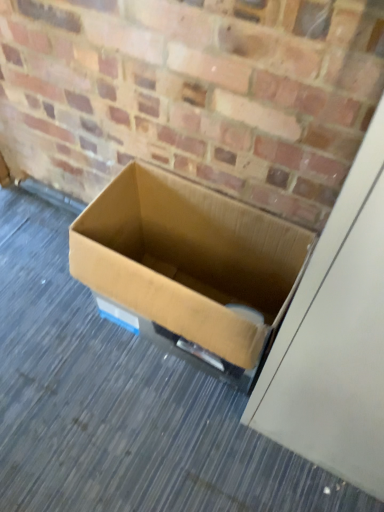
This screenshot has width=384, height=512. I want to click on brown cardboard box at center, so click(x=188, y=260).

The width and height of the screenshot is (384, 512). What do you see at coordinates (188, 260) in the screenshot? I see `brown cardboard box at center` at bounding box center [188, 260].

Where is `brown cardboard box at center`? The height and width of the screenshot is (512, 384). brown cardboard box at center is located at coordinates (121, 403).

Describe the element at coordinates (121, 403) in the screenshot. I see `brown cardboard box at center` at that location.

This screenshot has height=512, width=384. In order to click on brown cardboard box at center in this screenshot , I will do `click(188, 260)`.

Can you confirm if brown cardboard box at center is positioned to the left of brown cardboard box at center?

No.

Which is behind, brown cardboard box at center or brown cardboard box at center?

brown cardboard box at center is further away from the camera.

Does point (161, 243) appear closer or farther from the camera than point (80, 417)?

Point (161, 243) is positioned farther from the camera compared to point (80, 417).

From the image's perspective, which one is positioned lower, brown cardboard box at center or brown cardboard box at center?

brown cardboard box at center, from the image's perspective.

From a real-world perspective, is brown cardboard box at center under brown cardboard box at center?

No, from a real-world perspective, brown cardboard box at center is not under brown cardboard box at center.

Between brown cardboard box at center and brown cardboard box at center, which one has smaller width?

brown cardboard box at center is thinner.

Considering the relative sizes of brown cardboard box at center and brown cardboard box at center in the image provided, is brown cardboard box at center taller than brown cardboard box at center?

Indeed, brown cardboard box at center has a greater height compared to brown cardboard box at center.

In terms of size, does brown cardboard box at center appear bigger or smaller than brown cardboard box at center?

In the image, brown cardboard box at center appears to be larger than brown cardboard box at center.

Do you think brown cardboard box at center is within brown cardboard box at center, or outside of it?

brown cardboard box at center is not enclosed by brown cardboard box at center.

Is brown cardboard box at center touching brown cardboard box at center?

No, brown cardboard box at center is not next to brown cardboard box at center.

Is brown cardboard box at center looking in the opposite direction of brown cardboard box at center?

No, brown cardboard box at center is not at the back of brown cardboard box at center.

What's the angular difference between brown cardboard box at center and brown cardboard box at center's facing directions?

The angle between the facing direction of brown cardboard box at center and the facing direction of brown cardboard box at center is 88.8 degrees.

Based on the photo, how distant is brown cardboard box at center from brown cardboard box at center?

14.57 inches.

Locate an element on the screen. The image size is (384, 512). alley beneath the brown cardboard box at center (from a real-world perspective) is located at coordinates (121, 403).

Is brown cardboard box at center to the right of brown cardboard box at center from the viewer's perspective?

Incorrect, brown cardboard box at center is not on the right side of brown cardboard box at center.

Considering their positions, is brown cardboard box at center located in front of or behind brown cardboard box at center?

brown cardboard box at center is behind brown cardboard box at center.

Considering the points (79, 354) and (275, 323), which point is behind, point (79, 354) or point (275, 323)?

The point (79, 354) is farther from the camera.

From the image's perspective, between brown cardboard box at center and brown cardboard box at center, which one is located above?

brown cardboard box at center appears higher in the image.

From a real-world perspective, is brown cardboard box at center positioned under brown cardboard box at center based on gravity?

Yes, from a real-world perspective, brown cardboard box at center is below brown cardboard box at center.

Looking at their sizes, would you say brown cardboard box at center is wider or thinner than brown cardboard box at center?

Clearly, brown cardboard box at center has more width compared to brown cardboard box at center.

In terms of height, does brown cardboard box at center look taller or shorter compared to brown cardboard box at center?

brown cardboard box at center is shorter than brown cardboard box at center.

Is brown cardboard box at center bigger or smaller than brown cardboard box at center?

Clearly, brown cardboard box at center is smaller in size than brown cardboard box at center.

Is brown cardboard box at center completely or partially outside of brown cardboard box at center?

brown cardboard box at center is positioned outside brown cardboard box at center.

Is brown cardboard box at center not near brown cardboard box at center?

No, brown cardboard box at center is not far from brown cardboard box at center.

Is brown cardboard box at center facing towards brown cardboard box at center?

No, brown cardboard box at center is not facing towards brown cardboard box at center.

What's the angular difference between brown cardboard box at center and brown cardboard box at center's facing directions?

88.8 degrees separate the facing orientations of brown cardboard box at center and brown cardboard box at center.

At what (x,y) coordinates should I click in order to perform the action: click on alley below the brown cardboard box at center (from a real-world perspective). Please return your answer as a coordinate pair (x, y). This screenshot has height=512, width=384. Looking at the image, I should click on (121, 403).

In the image, there is a brown cardboard box at center. Find the location of `alley below it (from the image's perspective)`. alley below it (from the image's perspective) is located at coordinates (121, 403).

The image size is (384, 512). I want to click on alley behind the brown cardboard box at center, so click(x=121, y=403).